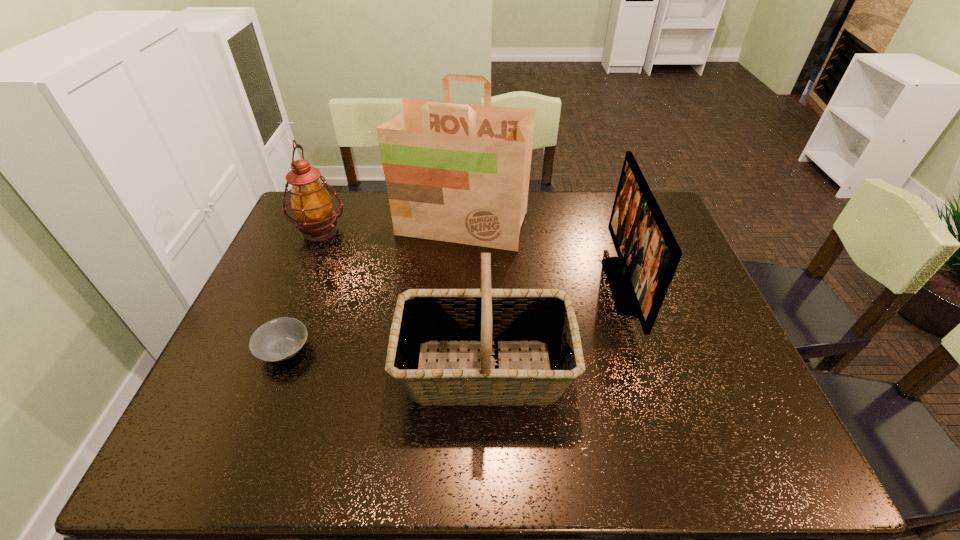
The height and width of the screenshot is (540, 960). I want to click on object that is the third closest to the shortest object, so click(459, 173).

This screenshot has height=540, width=960. I want to click on free space that satisfies the following two spatial constraints: 1. on the front side of the bowl; 2. on the left side of the oil lamp, so click(x=271, y=350).